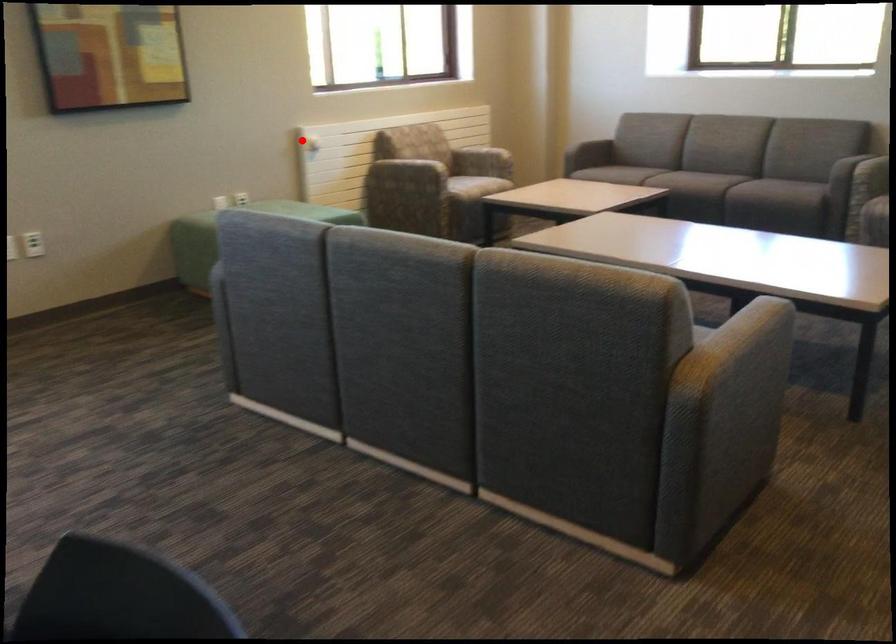
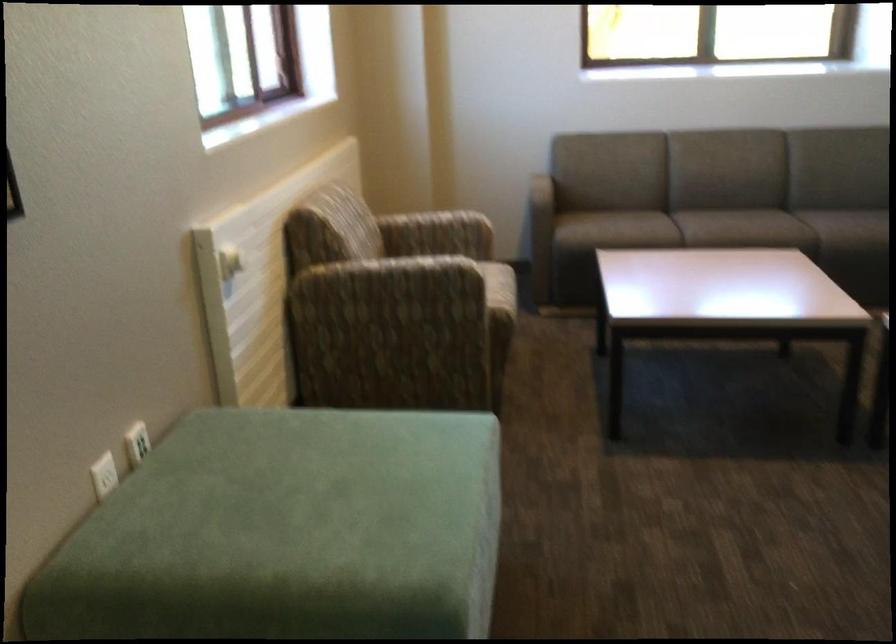
The point at the highlighted location is marked in the first image. Where is the corresponding point in the second image?

(229, 263)